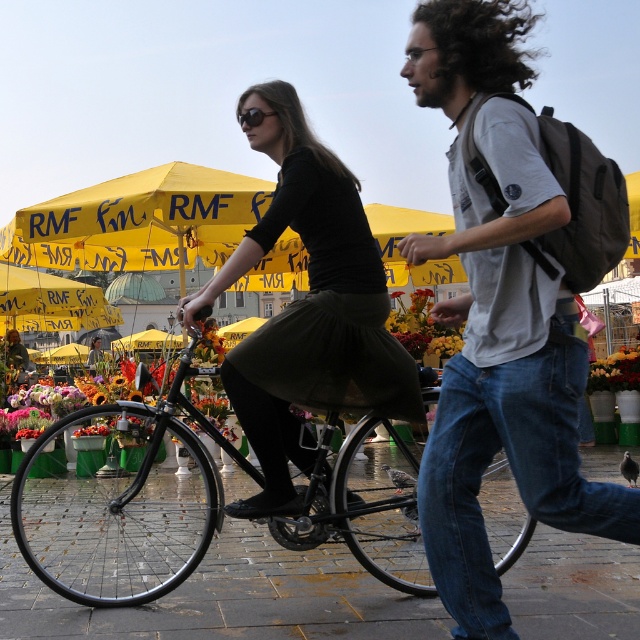
Question: Is shiny black bicycle at center wider than black matte sunglasses at upper center?

Choices:
 (A) yes
 (B) no

Answer: (A)

Question: Among these objects, which one is nearest to the camera?

Choices:
 (A) shiny black bicycle at center
 (B) vibrant floral bouquet at center
 (C) black matte dress at center

Answer: (C)

Question: Does shiny black bicycle at center have a lesser width compared to black matte sunglasses at upper center?

Choices:
 (A) no
 (B) yes

Answer: (A)

Question: Does shiny black bicycle at center appear on the right side of black matte dress at center?

Choices:
 (A) no
 (B) yes

Answer: (A)

Question: Which point is closer to the camera taking this photo?

Choices:
 (A) (573, 324)
 (B) (401, 336)
 (C) (77, 531)
 (D) (244, 116)

Answer: (A)

Question: Among these points, which one is nearest to the camera?

Choices:
 (A) (541, 422)
 (B) (403, 342)
 (C) (352, 365)
 (D) (262, 115)

Answer: (A)